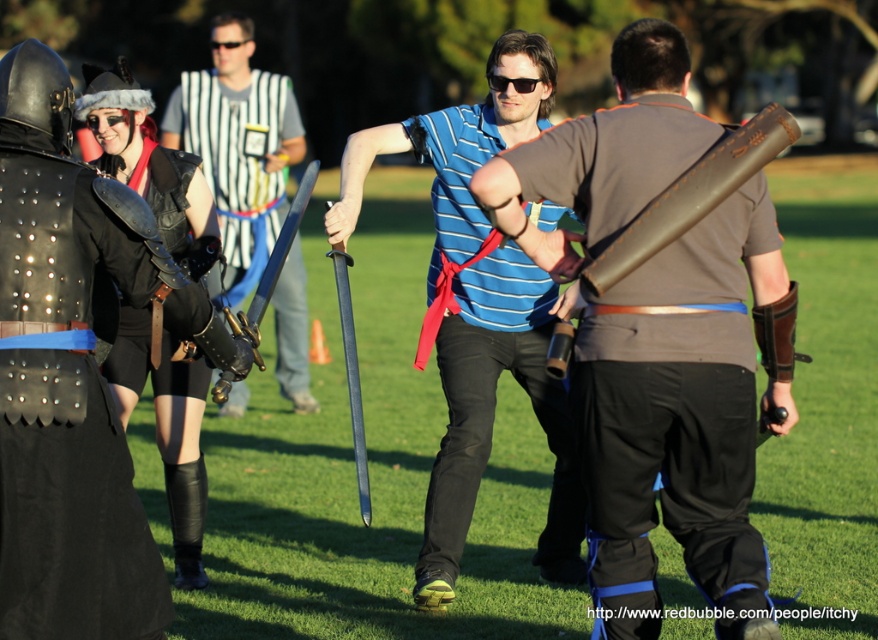
Question: Which object is closer to the camera taking this photo?

Choices:
 (A) matte brown leather sword at center
 (B) polished steel sword at center

Answer: (A)

Question: Can you confirm if blue striped shirt at center is positioned to the right of brown leather scroll at right?

Choices:
 (A) no
 (B) yes

Answer: (A)

Question: Is brown leather scroll at right to the left of shiny silver sword at center from the viewer's perspective?

Choices:
 (A) no
 (B) yes

Answer: (A)

Question: Can you confirm if matte brown leather sword at center is thinner than shiny silver sword at center?

Choices:
 (A) no
 (B) yes

Answer: (A)

Question: Which of the following is the closest to the observer?

Choices:
 (A) shiny blue sword at center
 (B) matte brown leather sword at center
 (C) shiny silver sword at center
 (D) polished steel sword at center

Answer: (B)

Question: Which of the following is the farthest from the observer?

Choices:
 (A) shiny silver sword at center
 (B) brown leather scroll at right
 (C) polished steel sword at center

Answer: (C)